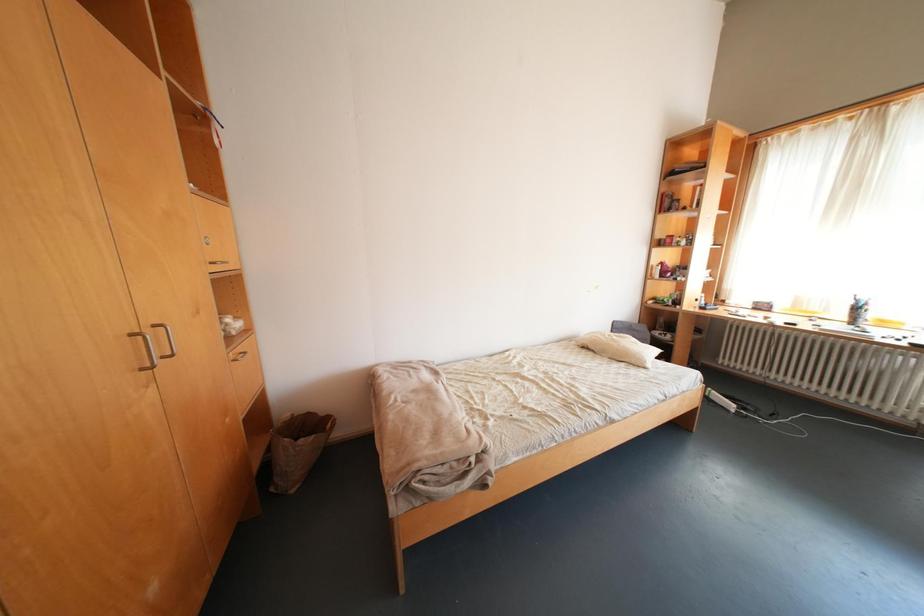
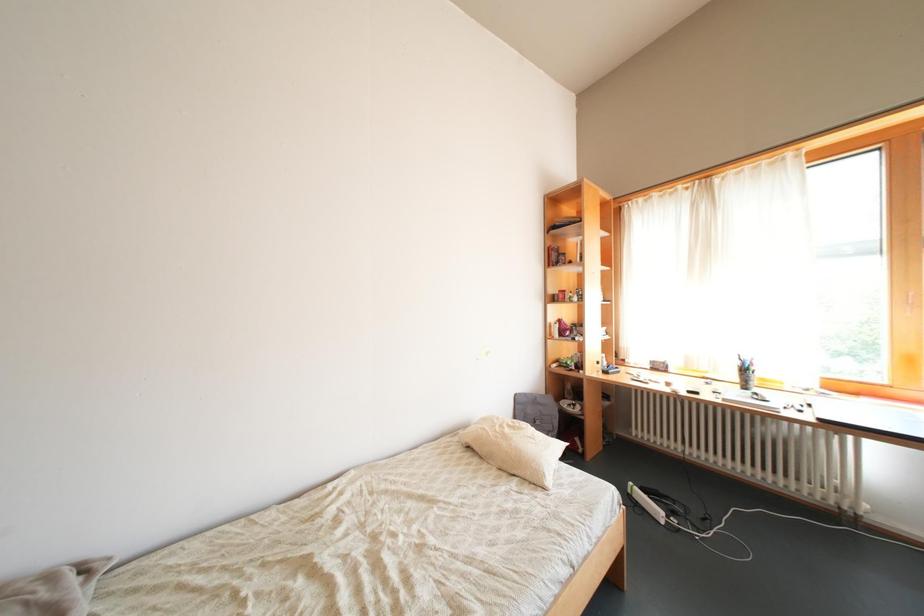
What movement of the cameraman would produce the second image?

The cameraman walked toward right, forward.